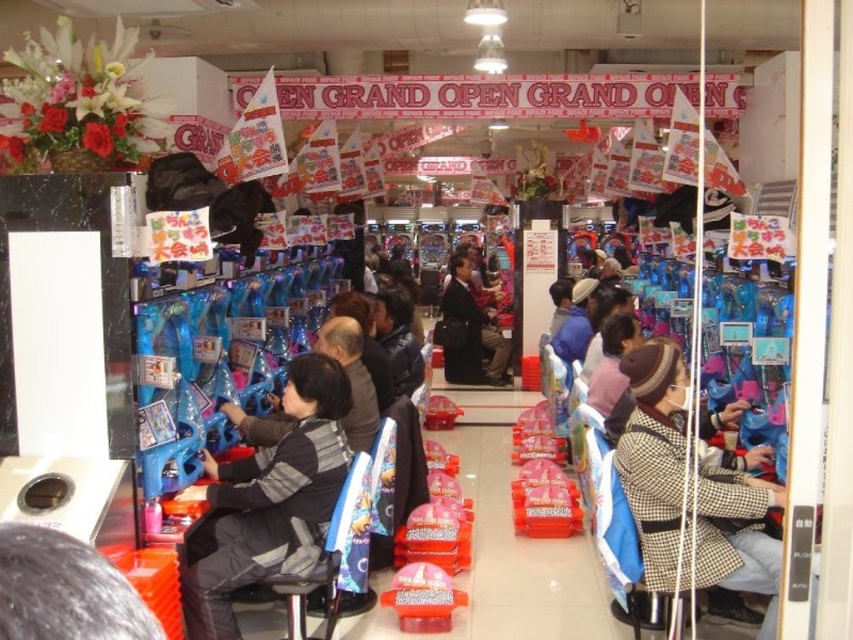
Question: Does gray fabric jacket at center appear on the left side of leather jacket at center?

Choices:
 (A) no
 (B) yes

Answer: (B)

Question: Estimate the real-world distances between objects in this image. Which object is closer to the rubberized plastic toy at center?

Choices:
 (A) checkered wool coat at center
 (B) gray fabric jacket at center
 (C) leather jacket at center

Answer: (B)

Question: Which object appears farthest from the camera in this image?

Choices:
 (A) rubberized plastic toy at center
 (B) dark gray suit at center

Answer: (B)

Question: From the image, what is the correct spatial relationship of dark gray suit at center in relation to rubberized plastic toy at center?

Choices:
 (A) above
 (B) below

Answer: (A)

Question: Estimate the real-world distances between objects in this image. Which object is closer to the leather jacket at center?

Choices:
 (A) gray fabric jacket at center
 (B) dark gray suit at center

Answer: (A)

Question: Does dark gray suit at center appear on the right side of rubberized plastic toy at center?

Choices:
 (A) no
 (B) yes

Answer: (B)